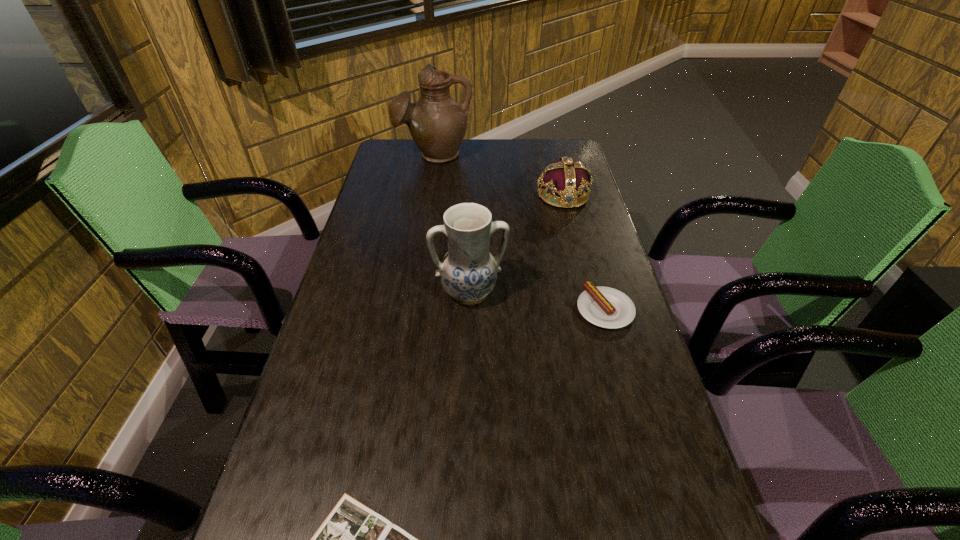
Identify the location of object at the far edge. The image size is (960, 540). (437, 123).

The height and width of the screenshot is (540, 960). I want to click on object that is positioned at the left edge, so click(x=437, y=123).

What are the coordinates of `crown that is at the right edge` in the screenshot? It's located at pyautogui.click(x=566, y=178).

Identify the location of sausage at the right edge. The image size is (960, 540). (606, 307).

You are a GUI agent. You are given a task and a screenshot of the screen. Output one action in this format:
    pyautogui.click(x=<x>, y=<y>)
    Task: Click on the object situated at the far left corner
    The image size is (960, 540).
    Given the screenshot: What is the action you would take?
    pyautogui.click(x=437, y=123)

Image resolution: width=960 pixels, height=540 pixels. In the image, there is a desktop. Find the location of `blank space at the far edge`. blank space at the far edge is located at coordinates (487, 164).

Find the location of a particular element. vacant space at the left edge is located at coordinates (401, 222).

Locate an element on the screen. blank space at the right edge of the desktop is located at coordinates (646, 437).

Where is `vacant space at the far left corner of the desktop`? The width and height of the screenshot is (960, 540). vacant space at the far left corner of the desktop is located at coordinates (384, 160).

In order to click on free spot at the far right corner of the desktop in this screenshot , I will do `click(541, 148)`.